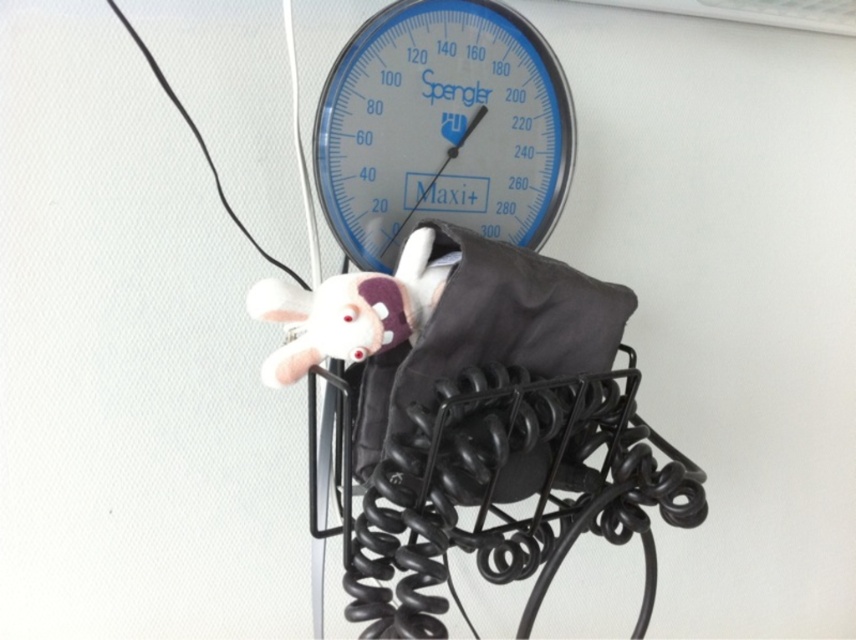
You are a nurse checking the blood pressure monitor. You notice the blue glass gauge at center and the white plush toy at center. Which object is taller?

The blue glass gauge at center is taller than the white plush toy at center.

You are a nurse checking the blood pressure monitor. You notice two items at the center of your view. Which one is closer to you, the blue glass gauge at center or the white plush toy at center?

The blue glass gauge at center is closer to you than the white plush toy at center.

You are a nurse checking the blood pressure monitor in a clinic. You see the blue glass gauge at center and the white plush toy at center. Which object is larger?

The blue glass gauge at center is bigger than the white plush toy at center.